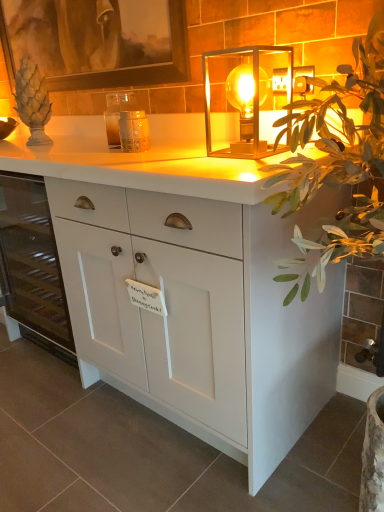
What do you see at coordinates (190, 285) in the screenshot? The width and height of the screenshot is (384, 512). I see `white matte cabinet at center` at bounding box center [190, 285].

Describe the element at coordinates (243, 99) in the screenshot. I see `translucent glass cube at center` at that location.

The width and height of the screenshot is (384, 512). What do you see at coordinates (134, 131) in the screenshot?
I see `translucent glass candle holder at center` at bounding box center [134, 131].

What is the approximate width of translucent glass candle holder at center?

4.29 inches.

What do you see at coordinates (90, 46) in the screenshot?
I see `wooden picture frame at upper left` at bounding box center [90, 46].

In order to face white matte cabinet at left, should I rotate leftwards or rightwards?

Rotate left and turn 25.157 degrees.

Find the location of a particular element. The width and height of the screenshot is (384, 512). white matte cabinet at center is located at coordinates (190, 285).

Is translucent glass candle holder at center to the right of white matte cabinet at left from the viewer's perspective?

Correct, you'll find translucent glass candle holder at center to the right of white matte cabinet at left.

Between translucent glass candle holder at center and white matte cabinet at left, which one has larger size?

white matte cabinet at left is bigger.

Is translucent glass candle holder at center facing away from white matte cabinet at left?

translucent glass candle holder at center is not turned away from white matte cabinet at left.

Is wooden picture frame at upper left turned away from translucent glass cube at center?

No, translucent glass cube at center is not at the back of wooden picture frame at upper left.

Considering the points (183, 42) and (239, 51), which point is in front, point (183, 42) or point (239, 51)?

Positioned in front is point (239, 51).

Which of these two, wooden picture frame at upper left or translucent glass cube at center, is smaller?

translucent glass cube at center is smaller.

Considering the relative sizes of wooden picture frame at upper left and translucent glass cube at center in the image provided, is wooden picture frame at upper left shorter than translucent glass cube at center?

No, wooden picture frame at upper left is not shorter than translucent glass cube at center.

Is translucent glass candle holder at center wider or thinner than wooden picture frame at upper left?

In the image, translucent glass candle holder at center appears to be wider than wooden picture frame at upper left.

Find the location of a particular element. This screenshot has height=512, width=384. picture frame behind the translucent glass candle holder at center is located at coordinates (90, 46).

From the image's perspective, which is below, translucent glass candle holder at center or wooden picture frame at upper left?

From the image's view, translucent glass candle holder at center is below.

Could you tell me if translucent glass candle holder at center is facing wooden picture frame at upper left?

No, translucent glass candle holder at center is not facing towards wooden picture frame at upper left.

What's the angular difference between wooden picture frame at upper left and white matte cabinet at center's facing directions?

0.707 degrees.

Is wooden picture frame at upper left inside or outside of white matte cabinet at center?

wooden picture frame at upper left is outside white matte cabinet at center.

Considering the relative sizes of wooden picture frame at upper left and white matte cabinet at center in the image provided, is wooden picture frame at upper left bigger than white matte cabinet at center?

Actually, wooden picture frame at upper left might be smaller than white matte cabinet at center.

Is wooden picture frame at upper left facing away from white matte cabinet at center?

wooden picture frame at upper left is not turned away from white matte cabinet at center.

Considering the positions of objects wooden picture frame at upper left and translucent glass candle holder at center in the image provided, who is more to the left, wooden picture frame at upper left or translucent glass candle holder at center?

From the viewer's perspective, wooden picture frame at upper left appears more on the left side.

Could you tell me if wooden picture frame at upper left is turned towards translucent glass candle holder at center?

No, wooden picture frame at upper left is not oriented towards translucent glass candle holder at center.

Is wooden picture frame at upper left with translucent glass candle holder at center?

No, wooden picture frame at upper left is not touching translucent glass candle holder at center.

From a real-world perspective, is translucent glass cube at center beneath wooden picture frame at upper left?

Correct, in the physical world, translucent glass cube at center is lower than wooden picture frame at upper left.

Which is more to the right, translucent glass cube at center or wooden picture frame at upper left?

translucent glass cube at center is more to the right.

Which of these two, translucent glass cube at center or wooden picture frame at upper left, is wider?

With larger width is translucent glass cube at center.

Between point (207, 90) and point (136, 120), which one is positioned in front?

The point (136, 120) is closer.

Is translucent glass cube at center turned away from translucent glass candle holder at center?

translucent glass cube at center is not turned away from translucent glass candle holder at center.

In terms of width, does translucent glass cube at center look wider or thinner when compared to translucent glass candle holder at center?

Clearly, translucent glass cube at center has more width compared to translucent glass candle holder at center.

From the picture: Is translucent glass cube at center outside of translucent glass candle holder at center?

Yes, translucent glass cube at center is outside of translucent glass candle holder at center.

Identify the location of cabinetry below the translucent glass candle holder at center (from a real-world perspective). This screenshot has height=512, width=384. (32, 266).

Locate an element on the screen. picture frame above the translucent glass cube at center (from the image's perspective) is located at coordinates (90, 46).

When comparing their distances from translucent glass cube at center, does white matte cabinet at center or translucent glass candle holder at center seem closer?

The object closer to translucent glass cube at center is translucent glass candle holder at center.

Looking at the image, which one is located closer to wooden picture frame at upper left, translucent glass candle holder at center or translucent glass cube at center?

translucent glass cube at center.

When comparing their distances from translucent glass candle holder at center, does wooden picture frame at upper left or white matte cabinet at center seem closer?

white matte cabinet at center is positioned closer to the anchor translucent glass candle holder at center.

Based on their spatial positions, is translucent glass cube at center or translucent glass candle holder at center further from white matte cabinet at center?

Based on the image, translucent glass candle holder at center appears to be further to white matte cabinet at center.

From the image, which object appears to be farther from translucent glass candle holder at center, wooden picture frame at upper left or translucent glass cube at center?

wooden picture frame at upper left is positioned further to the anchor translucent glass candle holder at center.

Looking at the image, which one is located further to wooden picture frame at upper left, white matte cabinet at left or translucent glass cube at center?

Based on the image, white matte cabinet at left appears to be further to wooden picture frame at upper left.

Estimate the real-world distances between objects in this image. Which object is further from translucent glass cube at center, white matte cabinet at center or white matte cabinet at left?

The object further to translucent glass cube at center is white matte cabinet at left.

Based on their spatial positions, is wooden picture frame at upper left or white matte cabinet at center closer to white matte cabinet at left?

white matte cabinet at center lies closer to white matte cabinet at left than the other object.

What are the coordinates of `picture frame between white matte cabinet at left and translucent glass candle holder at center` in the screenshot? It's located at (90, 46).

This screenshot has width=384, height=512. What are the coordinates of `picture frame between white matte cabinet at left and white matte cabinet at center in the horizontal direction` in the screenshot? It's located at (90, 46).

Find the location of `candle holder located between wooden picture frame at upper left and translucent glass cube at center in the left-right direction`. candle holder located between wooden picture frame at upper left and translucent glass cube at center in the left-right direction is located at coordinates (134, 131).

The height and width of the screenshot is (512, 384). I want to click on chest of drawers between white matte cabinet at left and translucent glass cube at center from left to right, so click(190, 285).